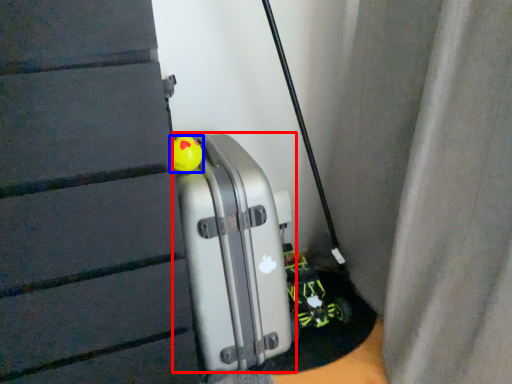
Question: Which of the following is the closest to the observer, luggage (highlighted by a red box) or toy (highlighted by a blue box)?

Choices:
 (A) luggage
 (B) toy

Answer: (A)